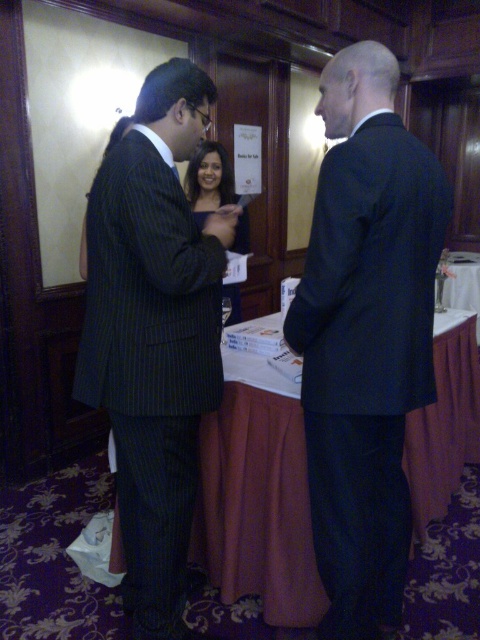
You are organizing a presentation and need to place the white paper at center and the matte black dress at center on a shelf. If the shelf has a width of 1 meter, can both items fit side by side?

The white paper at center is wider than the matte black dress at center, but since the shelf is 1 meter wide, both items can fit side by side as long as their combined widths do not exceed 1 meter. However, without knowing the exact dimensions of each item, it is impossible to determine definitively.

You are a photographer at a formal event. You need to capture a closeup of the white paper at center without the black smooth suit at center blocking the view. Is this possible given their positions?

The black smooth suit at center is taller than the white paper at center, so the suit may block the view of the white paper at center. Adjust your angle or position to ensure the white paper at center is visible without obstruction.

You are a guest at this event and you want to know which object is bigger between the white paper at center and the matte black dress at center. Can you tell me?

The white paper at center is larger in size than the matte black dress at center.